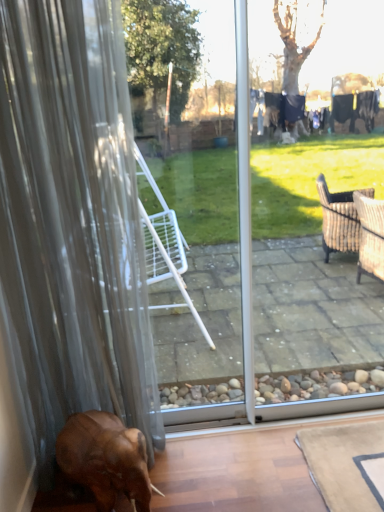
Question: Is translucent fabric curtain at left wider or thinner than brown matte elephant at lower left?

Choices:
 (A) wide
 (B) thin

Answer: (B)

Question: From the image's perspective, is translucent fabric curtain at left positioned above or below brown matte elephant at lower left?

Choices:
 (A) above
 (B) below

Answer: (A)

Question: Is translucent fabric curtain at left inside the boundaries of brown matte elephant at lower left, or outside?

Choices:
 (A) inside
 (B) outside

Answer: (B)

Question: Looking at the image, does brown matte elephant at lower left seem bigger or smaller compared to translucent fabric curtain at left?

Choices:
 (A) big
 (B) small

Answer: (B)

Question: From the image's perspective, is brown matte elephant at lower left above or below translucent fabric curtain at left?

Choices:
 (A) below
 (B) above

Answer: (A)

Question: Visually, is brown matte elephant at lower left positioned to the left or to the right of translucent fabric curtain at left?

Choices:
 (A) left
 (B) right

Answer: (B)

Question: Is point 132,501 closer or farther from the camera than point 132,315?

Choices:
 (A) farther
 (B) closer

Answer: (B)